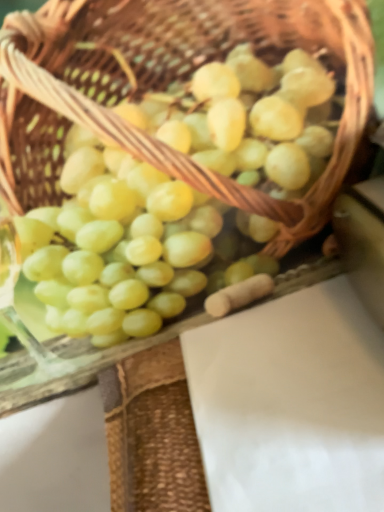
Measure the distance between point (x=161, y=296) and camera.

Point (x=161, y=296) and camera are 19.80 inches apart from each other.

The width and height of the screenshot is (384, 512). What do you see at coordinates (117, 243) in the screenshot?
I see `green matte grapes at upper left` at bounding box center [117, 243].

The width and height of the screenshot is (384, 512). In order to click on green matte grapes at upper left in this screenshot , I will do `click(117, 243)`.

Image resolution: width=384 pixels, height=512 pixels. What are the coordinates of `green matte grapes at upper left` in the screenshot? It's located at (x=117, y=243).